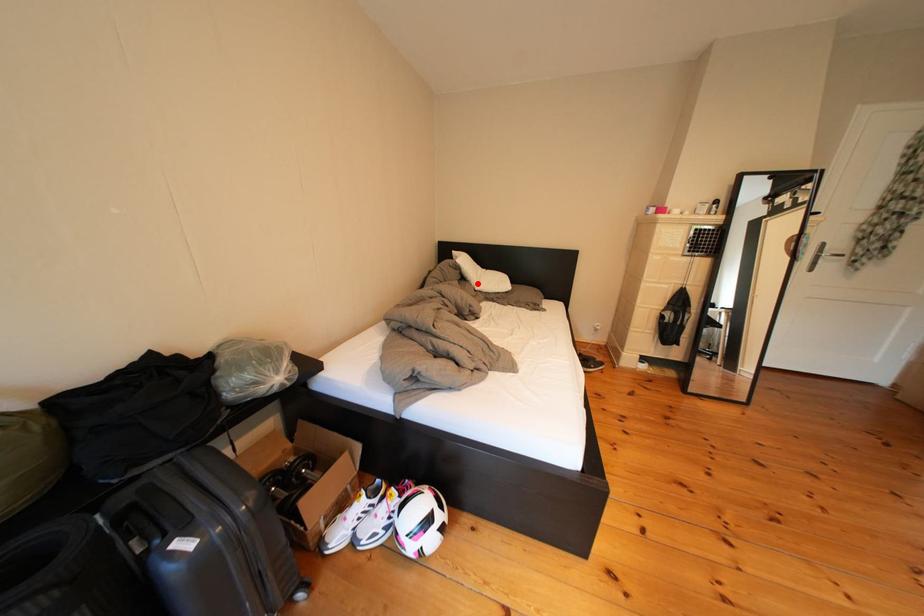
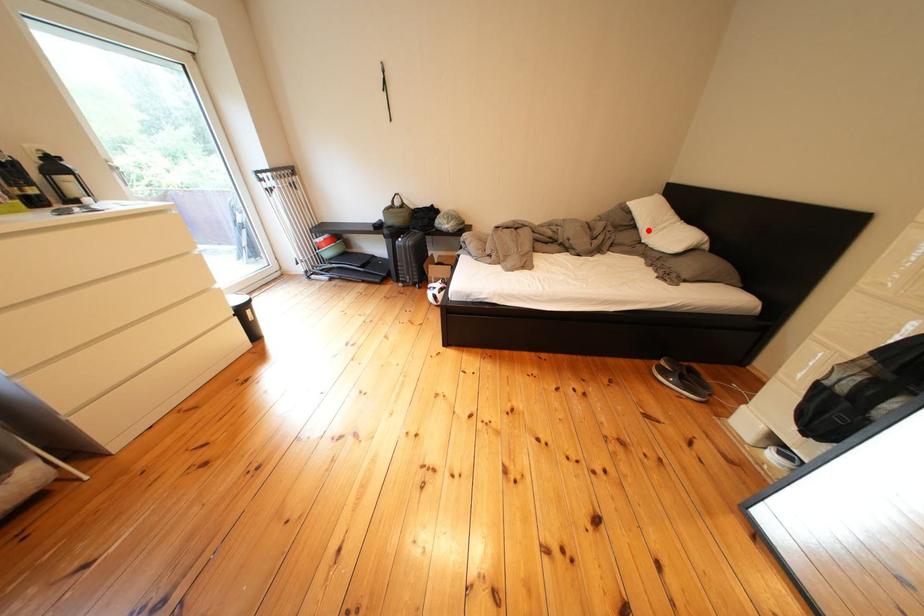
I am providing you with two images of the same scene from different viewpoints. A red point is marked on the first image and another point is marked on the second image. Do the highlighted points in image1 and image2 indicate the same real-world spot?

Yes